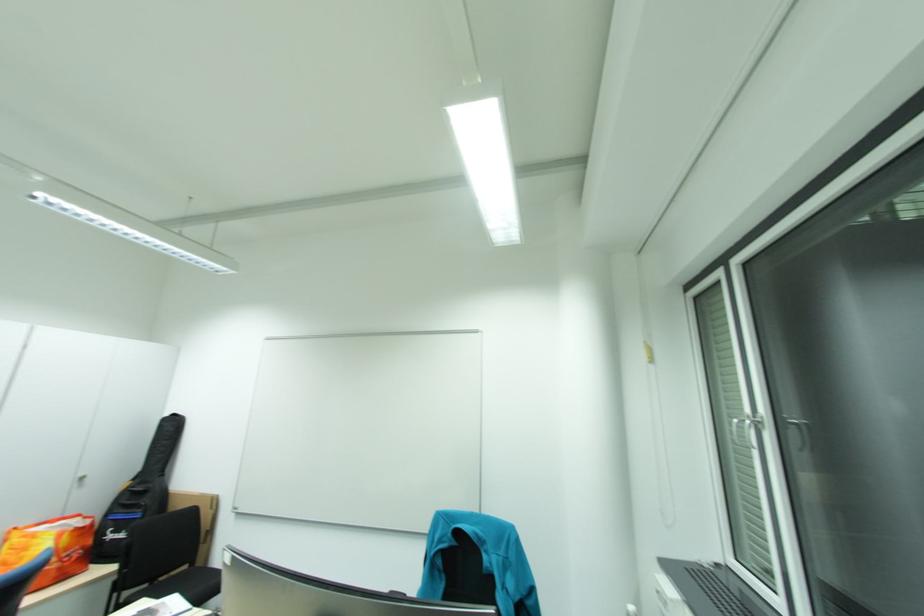
Where would you pull the white cabinet handle? Please return your answer as a coordinate pair (x, y).

(80, 480)